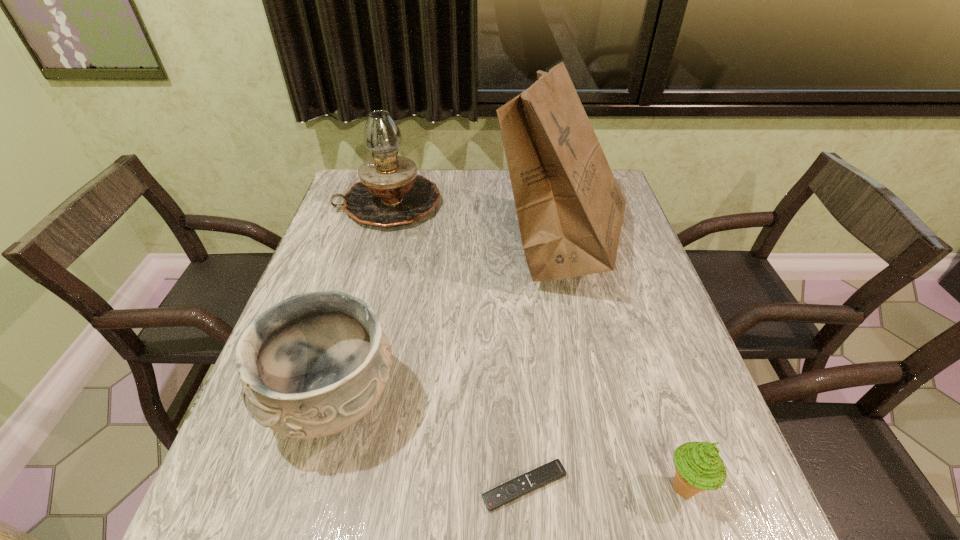
Image resolution: width=960 pixels, height=540 pixels. I want to click on grocery bag present at the far edge, so click(x=570, y=210).

Where is `oil lamp that is at the far edge`? This screenshot has height=540, width=960. oil lamp that is at the far edge is located at coordinates (390, 193).

Locate an element on the screen. icecream that is positioned at the near edge is located at coordinates (698, 466).

Locate an element on the screen. remote control that is at the near edge is located at coordinates (554, 470).

Where is `oil lamp at the left edge`? oil lamp at the left edge is located at coordinates (390, 193).

This screenshot has width=960, height=540. I want to click on pottery that is positioned at the left edge, so click(313, 365).

Locate an element on the screen. The image size is (960, 540). grocery bag at the right edge is located at coordinates (570, 210).

Where is `icecream located in the right edge section of the desktop`? The image size is (960, 540). icecream located in the right edge section of the desktop is located at coordinates (698, 466).

Locate an element on the screen. This screenshot has height=540, width=960. object located at the far left corner is located at coordinates (390, 193).

Find the location of a particular element. The height and width of the screenshot is (540, 960). object positioned at the far right corner is located at coordinates (570, 210).